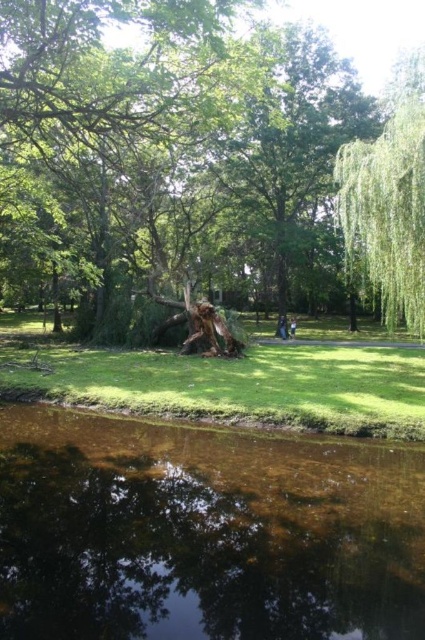
Question: Considering the relative positions of green grass at center and green leafy willow at right in the image provided, where is green grass at center located with respect to green leafy willow at right?

Choices:
 (A) left
 (B) right

Answer: (A)

Question: Among these points, which one is nearest to the camera?

Choices:
 (A) (414, 136)
 (B) (280, 317)
 (C) (294, 324)
 (D) (377, 252)

Answer: (A)

Question: Which is farther from the rough bark tree stump at center?

Choices:
 (A) green grass at center
 (B) green leafy willow at right

Answer: (A)

Question: Is green grass at center wider than light brown wooden bench at center?

Choices:
 (A) no
 (B) yes

Answer: (B)

Question: Which object is farther from the camera taking this photo?

Choices:
 (A) light brown wooden bench at center
 (B) clear water at lower center
 (C) dark blue fabric at center
 (D) green leafy willow at right

Answer: (C)

Question: Does green grass at center appear on the right side of light brown wooden bench at center?

Choices:
 (A) yes
 (B) no

Answer: (B)